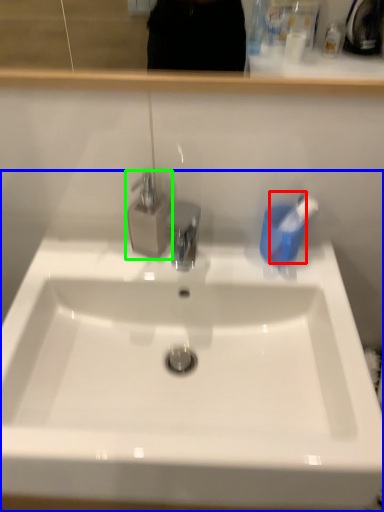
Question: Estimate the real-world distances between objects in this image. Which object is closer to toothbrush (highlighted by a red box), sink (highlighted by a blue box) or tap (highlighted by a green box)?

Choices:
 (A) sink
 (B) tap

Answer: (B)